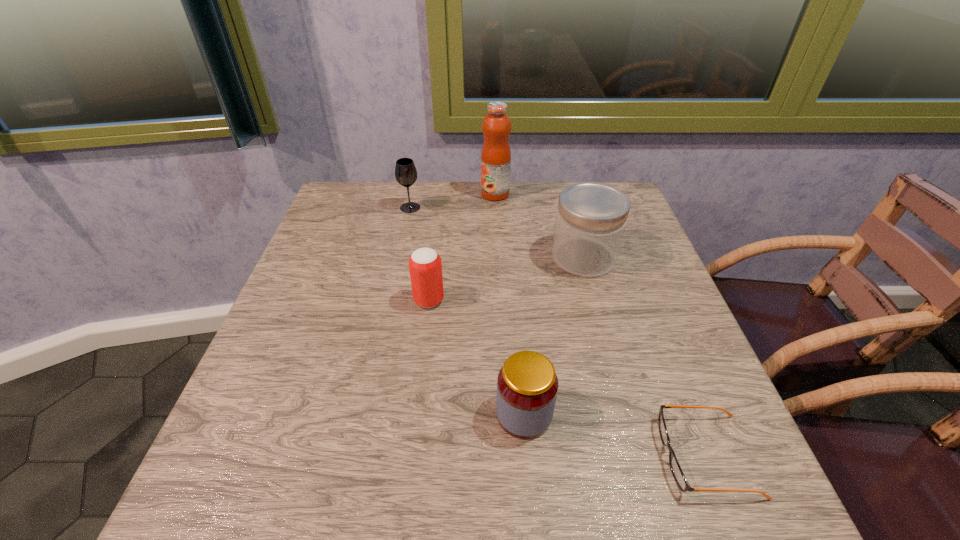
Image resolution: width=960 pixels, height=540 pixels. In order to click on the shortest object in this screenshot , I will do `click(677, 472)`.

At what (x,y) coordinates should I click in order to perform the action: click on vacant area situated on the front label of the fruit juice. Please return your answer as a coordinate pair (x, y). This screenshot has width=960, height=540. Looking at the image, I should click on (449, 194).

What are the coordinates of `vacant space situated 0.390m on the front label of the fruit juice` in the screenshot? It's located at (344, 194).

The width and height of the screenshot is (960, 540). What are the coordinates of `vacant space located 0.300m on the front label of the fruit juice` in the screenshot? It's located at (375, 194).

Where is `vacant area situated on the left of the right jar`? The image size is (960, 540). vacant area situated on the left of the right jar is located at coordinates (459, 258).

Image resolution: width=960 pixels, height=540 pixels. Identify the location of blank area located 0.250m on the front of the leftmost object. (396, 275).

Identify the location of vacant point located on the front of the third nearest object. (415, 420).

Identify the location of vacant space positioned 0.050m on the right of the nearer jar. The width and height of the screenshot is (960, 540). (582, 414).

Identify the location of vacant region located on the front-facing side of the shortest object. (598, 455).

Find the location of `vacant region located on the front-facing side of the shortest object`. vacant region located on the front-facing side of the shortest object is located at coordinates (547, 455).